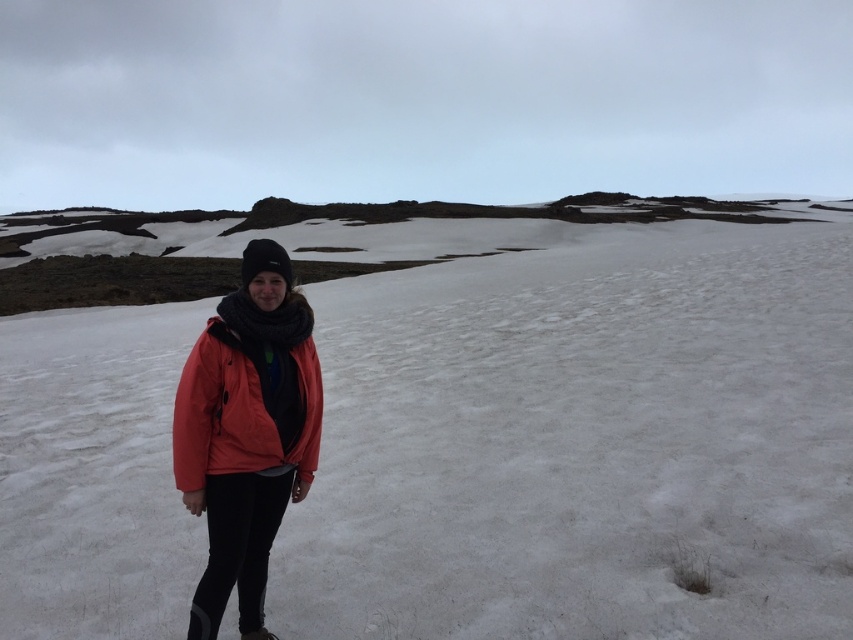
You are a drone operator trying to capture a closeup of the white powdery snow at center. According to the coordinates provided, where should you position your drone to get the best shot?

The white powdery snow at center is located at coordinates point [577,435], so you should position your drone at that point to capture the closeup.

You are a photographer trying to capture the person in the matte orange jacket at center. The white powdery snow at center is in your shot. To avoid the snow from blocking the jacket, should you move your camera to the left or right?

The white powdery snow at center is to the right of matte orange jacket at center, so moving the camera to the left would position the snow away from the jacket, avoiding it from blocking the view.